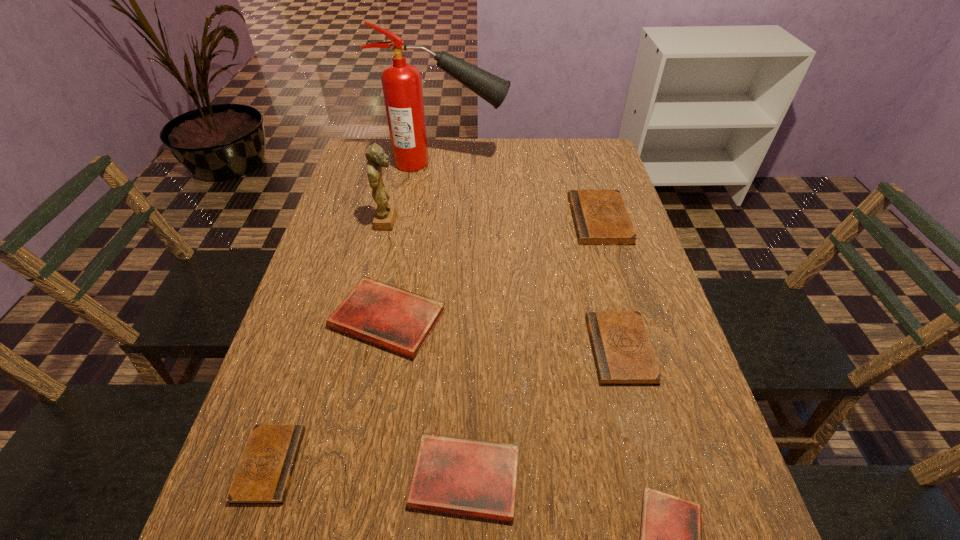
Identify the location of free space located 0.260m on the spine side of the smallest brown diary. The image size is (960, 540). (440, 464).

Find the location of a particular element. This screenshot has width=960, height=540. object that is positioned at the far edge is located at coordinates (402, 86).

The image size is (960, 540). Identify the location of fire extinguisher that is positioned at the left edge. (402, 86).

The height and width of the screenshot is (540, 960). I want to click on figurine that is at the left edge, so click(385, 215).

This screenshot has height=540, width=960. I want to click on object situated at the far left corner, so click(x=402, y=86).

Image resolution: width=960 pixels, height=540 pixels. Find the location of `free space at the far edge of the desktop`. free space at the far edge of the desktop is located at coordinates (427, 174).

Image resolution: width=960 pixels, height=540 pixels. What are the coordinates of `vacant space at the left edge` in the screenshot? It's located at (350, 184).

Find the location of a particular element. vacant space at the right edge is located at coordinates (639, 248).

The image size is (960, 540). What are the coordinates of `free spot between the second biggest brown diary and the second tallest object` in the screenshot? It's located at (504, 285).

Locate an element on the screen. unoccupied position between the farthest red diary and the second biggest red diary is located at coordinates (426, 398).